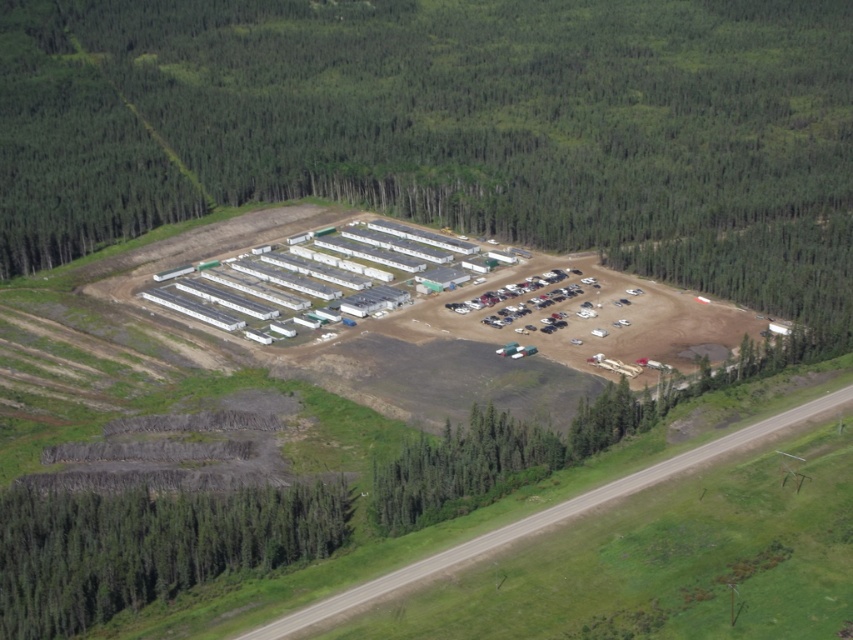
Question: Where is green leafy trees at center located in relation to metallic cars at center in the image?

Choices:
 (A) left
 (B) right

Answer: (A)

Question: Can you confirm if green leafy trees at center is smaller than green textured trees at lower left?

Choices:
 (A) yes
 (B) no

Answer: (B)

Question: Which object appears farthest from the camera in this image?

Choices:
 (A) metallic cars at center
 (B) green leafy trees at center

Answer: (A)

Question: Which object appears farthest from the camera in this image?

Choices:
 (A) green textured trees at lower left
 (B) green leafy trees at center

Answer: (B)

Question: Which point is closer to the camera taking this photo?

Choices:
 (A) (262, 22)
 (B) (508, 308)
 (C) (322, 513)

Answer: (C)

Question: In this image, where is green textured trees at lower left located relative to metallic cars at center?

Choices:
 (A) right
 (B) left

Answer: (B)